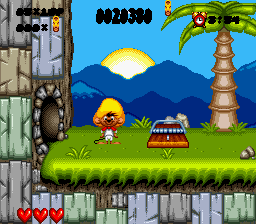
This screenshot has height=224, width=256. I want to click on mouse trap, so click(x=174, y=137).